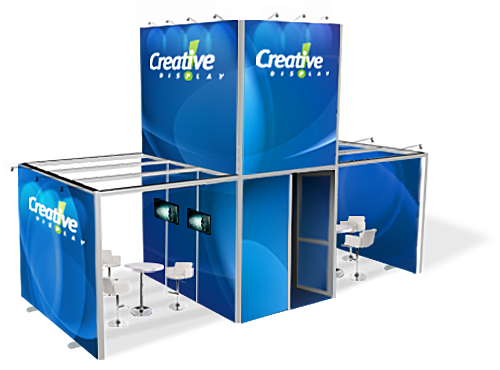
Locate an element on the screen. door is located at coordinates (311, 258).